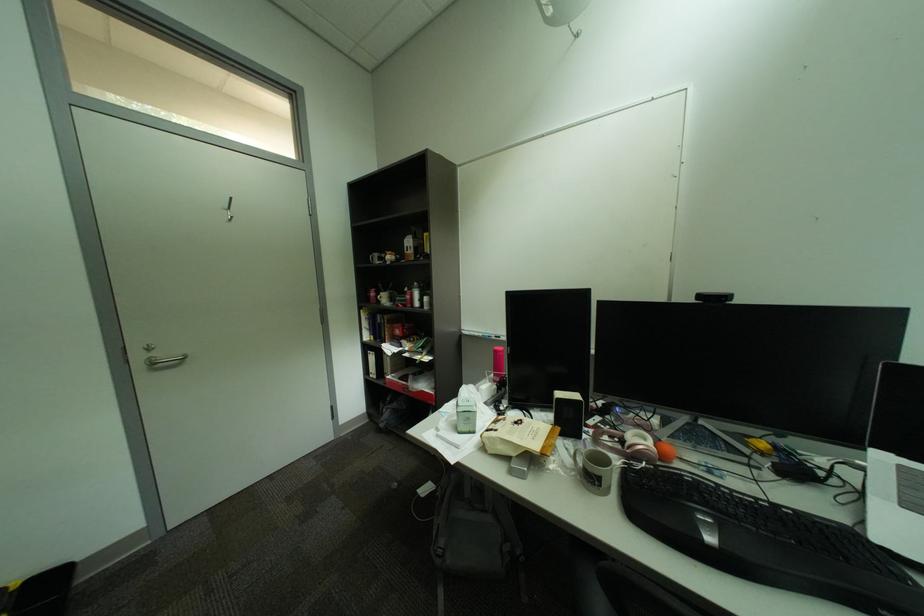
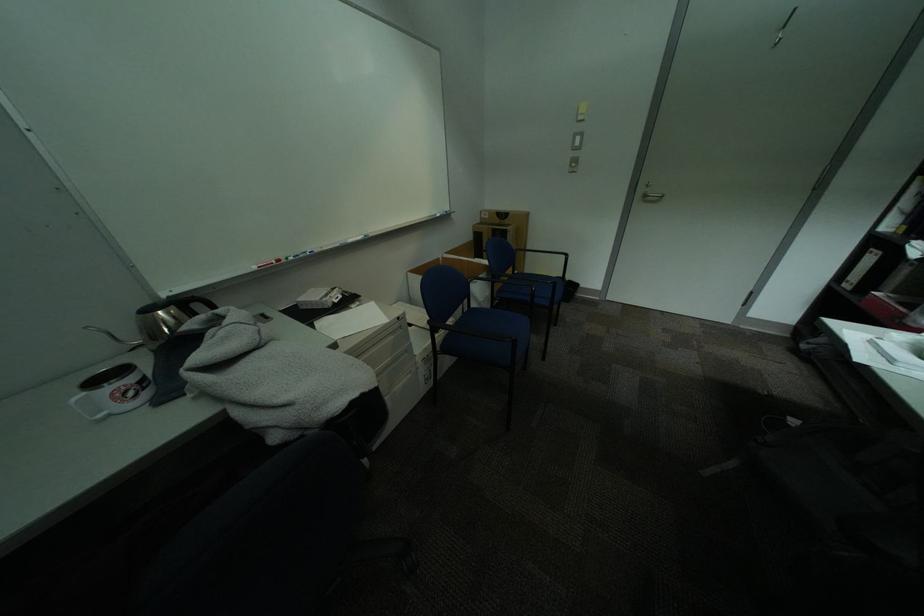
The first image is from the beginning of the video and the second image is from the end. How did the camera likely rotate when shooting the video?

The rotation direction of the camera is left-down.